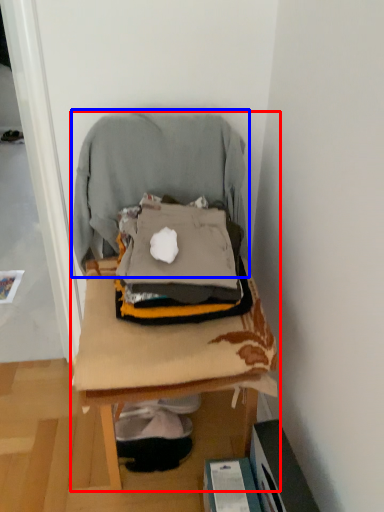
Question: Which of the following is the closest to the observer, furniture (highlighted by a red box) or bean bag chair (highlighted by a blue box)?

Choices:
 (A) furniture
 (B) bean bag chair

Answer: (A)